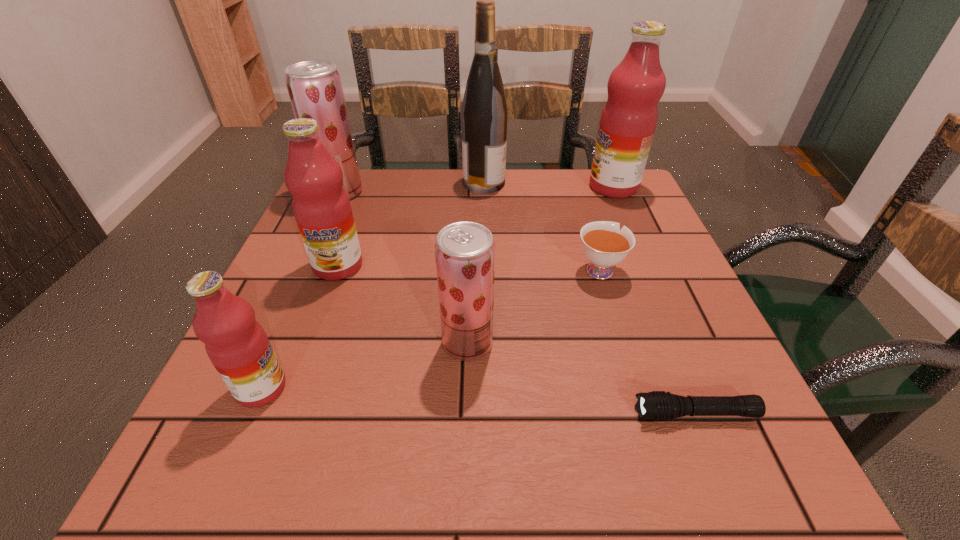
Find the location of a particular element. The width and height of the screenshot is (960, 540). the smallest pink fruit juice is located at coordinates (236, 344).

Locate an element on the screen. The height and width of the screenshot is (540, 960). the second shortest object is located at coordinates (605, 245).

I want to click on white teacup, so click(x=605, y=245).

You are a GUI agent. You are given a task and a screenshot of the screen. Output one action in this format:
    pyautogui.click(x=<x>, y=<y>)
    Task: Click on the shortest object
    
    Given the screenshot: What is the action you would take?
    pyautogui.click(x=657, y=405)

Locate an element on the screen. free space located 0.330m on the front of the wine bottle is located at coordinates (486, 283).

Image resolution: width=960 pixels, height=540 pixels. What are the coordinates of `free spot located 0.070m on the label of the farthest pink fruit juice` in the screenshot? It's located at (562, 187).

Find the location of a particular element. This screenshot has width=960, height=540. free spot located 0.310m on the label of the farthest pink fruit juice is located at coordinates (468, 187).

The height and width of the screenshot is (540, 960). Identify the location of free location located 0.060m on the label of the farthest pink fruit juice. (565, 187).

I want to click on vacant space located on the right of the left strawberry fruit juice, so click(434, 192).

Where is `vacant space located on the label of the third farthest fruit juice`? This screenshot has width=960, height=540. vacant space located on the label of the third farthest fruit juice is located at coordinates (278, 428).